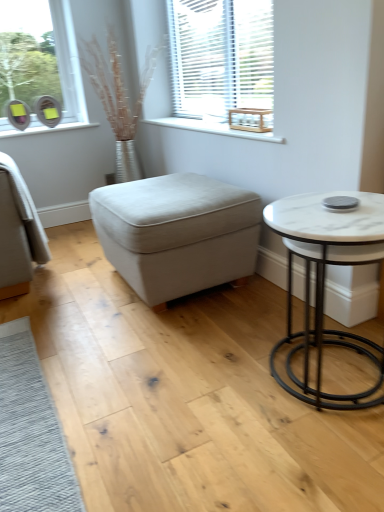
Identify the location of empty space that is in between white marble table at right and beige fabric ottoman at center. (230, 339).